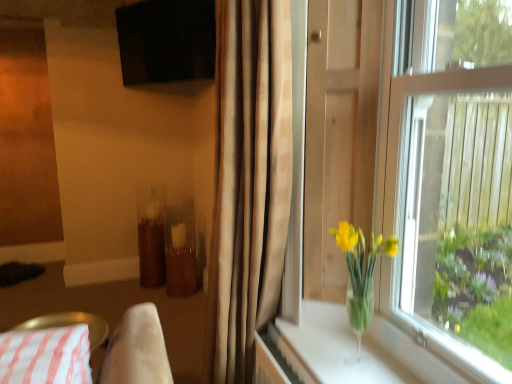
Where is `vacant space underneath translucent glass vase at window (from a real-world perspective)`? This screenshot has height=384, width=512. vacant space underneath translucent glass vase at window (from a real-world perspective) is located at coordinates (355, 362).